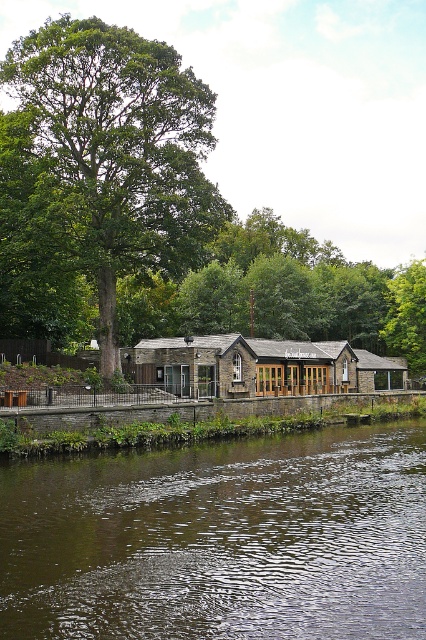
You are standing at the point labeled point (120, 216) and want to walk towards the riverbank. Which direction should you go relative to point (141, 531)?

You should walk towards point (141, 531) because it is in front of point (120, 216), meaning it is closer to the riverbank.

You are a visitor at The Boat House Inn and want to take a photo of both the green leafy tree at center and the green leafy tree at upper right. Which tree is positioned higher in the frame?

The green leafy tree at center is positioned higher in the frame than the green leafy tree at upper right.